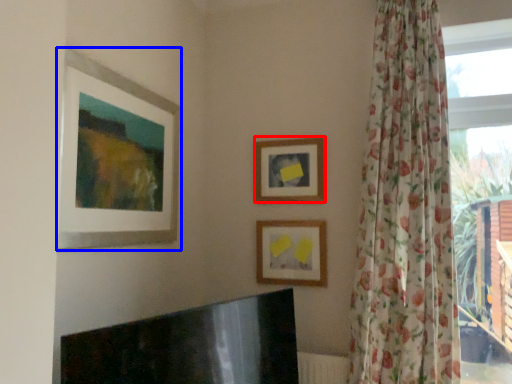
Question: Among these objects, which one is nearest to the camera, picture frame (highlighted by a red box) or picture frame (highlighted by a blue box)?

Choices:
 (A) picture frame
 (B) picture frame

Answer: (B)